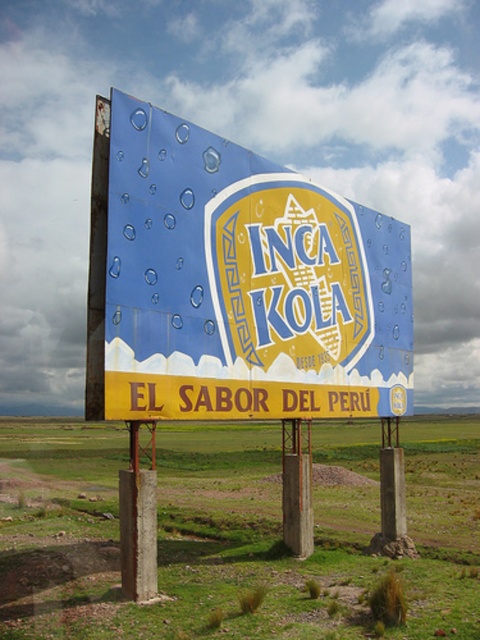
Who is higher up, blue painted billboard at center or yellow matte sign at center?

yellow matte sign at center is higher up.

Describe the element at coordinates (244, 284) in the screenshot. I see `blue painted billboard at center` at that location.

Where is `blue painted billboard at center`? This screenshot has width=480, height=640. blue painted billboard at center is located at coordinates (244, 284).

Consider the image. Can you confirm if green grass at center is smaller than yellow matte sign at center?

Incorrect, green grass at center is not smaller in size than yellow matte sign at center.

Who is more distant from viewer, (360, 582) or (260, 356)?

The point (260, 356) is behind.

I want to click on green grass at center, so click(232, 531).

Does point (9, 438) come farther from viewer compared to point (381, 308)?

Yes, it is behind point (381, 308).

Between green grass at center and blue painted billboard at center, which one has less height?

Standing shorter between the two is blue painted billboard at center.

This screenshot has width=480, height=640. In order to click on green grass at center in this screenshot , I will do `click(232, 531)`.